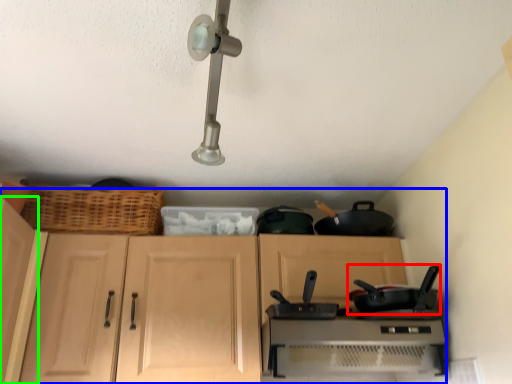
Question: Considering the real-world distances, which object is farthest from frying pan (highlighted by a red box)? dresser (highlighted by a blue box) or cabinetry (highlighted by a green box)?

Choices:
 (A) dresser
 (B) cabinetry

Answer: (B)